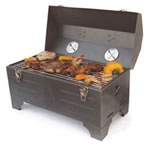
Where is `legs of the chest`? legs of the chest is located at coordinates coord(15,103), coord(99,131), coord(127,109).